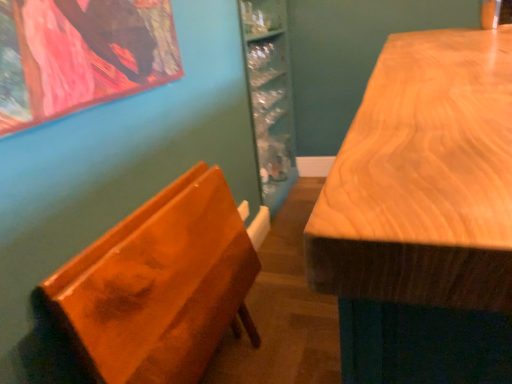
This screenshot has height=384, width=512. Describe the element at coordinates (423, 214) in the screenshot. I see `wooden table at right` at that location.

Locate an element on the screen. wooden table at right is located at coordinates (423, 214).

Image resolution: width=512 pixels, height=384 pixels. Identify the location of glossy wood chair at left. (160, 285).

What is the approximate width of glossy wood chair at left?

The width of glossy wood chair at left is 4.79 inches.

What do you see at coordinates (160, 285) in the screenshot? The image size is (512, 384). I see `glossy wood chair at left` at bounding box center [160, 285].

In order to face glossy wood chair at left, should I rotate leftwards or rightwards?

To face it directly, rotate left by 9.347 degrees.

The width and height of the screenshot is (512, 384). I want to click on wooden table at right, so click(423, 214).

Can you confirm if wooden table at right is positioned to the left of glossy wood chair at left?

No, wooden table at right is not to the left of glossy wood chair at left.

Is wooden table at right closer to camera compared to glossy wood chair at left?

Yes, the depth of wooden table at right is less than that of glossy wood chair at left.

Does point (364, 352) appear closer or farther from the camera than point (236, 245)?

Point (364, 352) is closer to the camera than point (236, 245).

Looking at this image, from the image's perspective, between wooden table at right and glossy wood chair at left, which one is located above?

wooden table at right appears higher in the image.

From a real-world perspective, which object rests below the other?

In real-world perspective, glossy wood chair at left is lower.

Which of these two, wooden table at right or glossy wood chair at left, is wider?

With larger width is wooden table at right.

Does wooden table at right have a lesser height compared to glossy wood chair at left?

In fact, wooden table at right may be taller than glossy wood chair at left.

Based on their sizes in the image, would you say wooden table at right is bigger or smaller than glossy wood chair at left?

In the image, wooden table at right appears to be larger than glossy wood chair at left.

Is wooden table at right not within glossy wood chair at left?

wooden table at right is positioned outside glossy wood chair at left.

Are wooden table at right and glossy wood chair at left far apart?

That's not correct — wooden table at right is a little close to glossy wood chair at left.

Consider the image. Is wooden table at right oriented away from glossy wood chair at left?

Yes, glossy wood chair at left is at the back of wooden table at right.

How distant is wooden table at right from glossy wood chair at left?

wooden table at right and glossy wood chair at left are 34.04 inches apart from each other.

Where is `table that is in front of the glossy wood chair at left`? table that is in front of the glossy wood chair at left is located at coordinates (423, 214).

Can you confirm if glossy wood chair at left is positioned to the right of wooden table at right?

No, glossy wood chair at left is not to the right of wooden table at right.

Which object is more forward, glossy wood chair at left or wooden table at right?

Positioned in front is wooden table at right.

Is point (144, 282) closer or farther from the camera than point (352, 278)?

Point (144, 282) is farther from the camera than point (352, 278).

From the image's perspective, is glossy wood chair at left under wooden table at right?

Correct, glossy wood chair at left appears lower than wooden table at right in the image.

From a real-world perspective, is glossy wood chair at left physically located above or below wooden table at right?

Clearly, from a real-world perspective, glossy wood chair at left is below wooden table at right.

Does glossy wood chair at left have a lesser width compared to wooden table at right?

Yes, glossy wood chair at left is thinner than wooden table at right.

Can you confirm if glossy wood chair at left is taller than wooden table at right?

In fact, glossy wood chair at left may be shorter than wooden table at right.

Considering the sizes of objects glossy wood chair at left and wooden table at right in the image provided, who is bigger, glossy wood chair at left or wooden table at right?

With larger size is wooden table at right.

Is glossy wood chair at left surrounding wooden table at right?

That's incorrect, wooden table at right is not inside glossy wood chair at left.

Does glossy wood chair at left touch wooden table at right?

glossy wood chair at left and wooden table at right are not in contact.

Is glossy wood chair at left aimed at wooden table at right?

Yes.

How different are the orientations of glossy wood chair at left and wooden table at right in degrees?

The facing directions of glossy wood chair at left and wooden table at right are 180 degrees apart.

The height and width of the screenshot is (384, 512). In the image, there is a wooden table at right. Identify the location of furniture below it (from a real-world perspective). (160, 285).

Image resolution: width=512 pixels, height=384 pixels. Identify the location of table above the glossy wood chair at left (from the image's perspective). (423, 214).

Identify the location of furniture that appears below the wooden table at right (from the image's perspective). (160, 285).